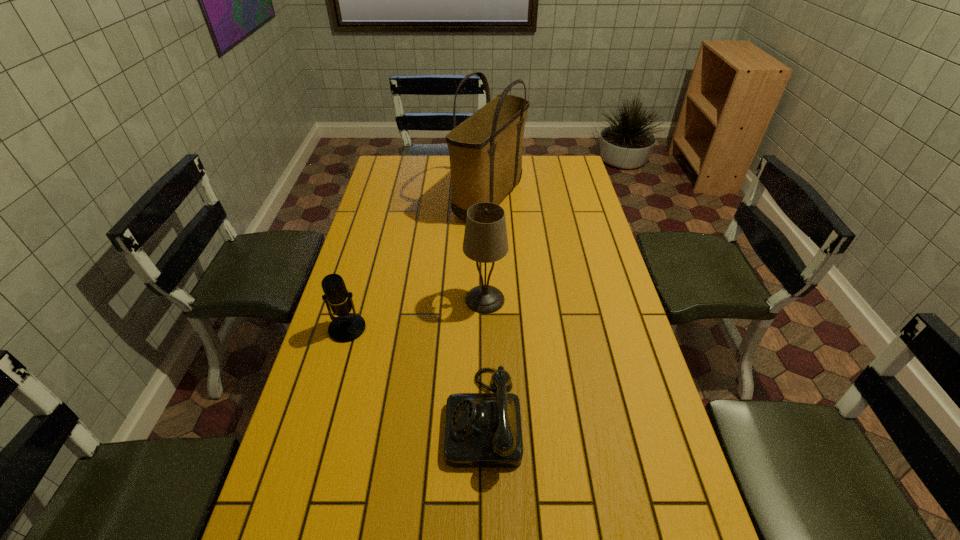
Locate an element on the screen. The width and height of the screenshot is (960, 540). the farthest object is located at coordinates (485, 150).

Find the location of a particular element. tote bag is located at coordinates (485, 150).

The height and width of the screenshot is (540, 960). I want to click on lampshade, so click(x=485, y=240).

Where is `the second farthest object`? This screenshot has width=960, height=540. the second farthest object is located at coordinates (485, 240).

Locate an element on the screen. This screenshot has height=540, width=960. the third tallest object is located at coordinates (346, 327).

This screenshot has width=960, height=540. Find the location of `the third farthest object`. the third farthest object is located at coordinates (346, 327).

At what (x,y) coordinates should I click in order to perform the action: click on the shortest object. Please return your answer as a coordinate pair (x, y). The width and height of the screenshot is (960, 540). Looking at the image, I should click on (482, 430).

Image resolution: width=960 pixels, height=540 pixels. What are the coordinates of `the nearest object` in the screenshot? It's located at (482, 430).

Find the location of a particular element. vacant point located 0.140m on the left of the tote bag is located at coordinates (418, 198).

Where is `vacant space positioned on the front-facing side of the lampshade`? Image resolution: width=960 pixels, height=540 pixels. vacant space positioned on the front-facing side of the lampshade is located at coordinates (356, 299).